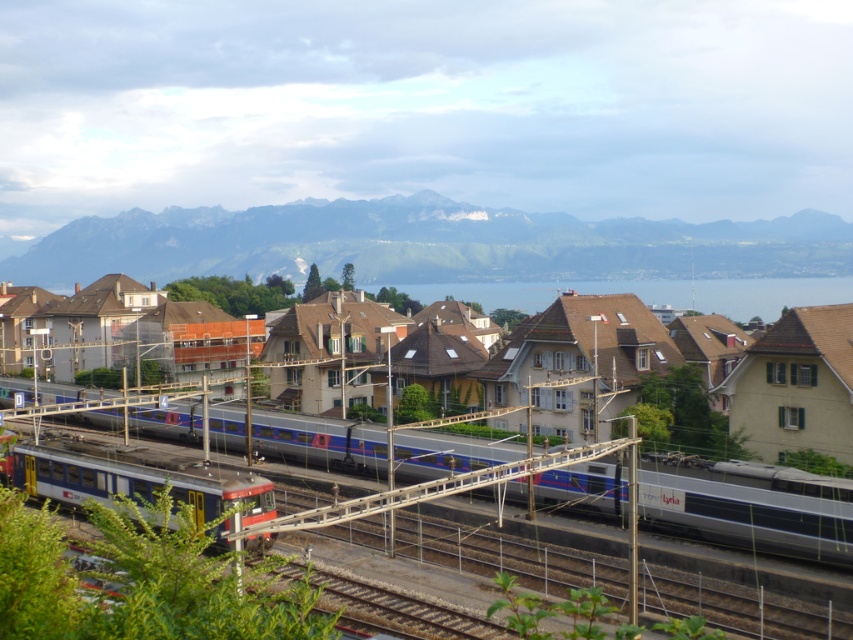
You are a photographer planning to capture the blue metallic train at lower left and the blue water at center in a single shot. Based on their sizes in the image, which object will appear smaller in the final photo?

The blue metallic train at lower left appears smaller in the final photo because it is shorter than the blue water at center.

You are a photographer trying to capture both the silver metallic train at center and the matte blue train at center in a single shot. Which train will appear narrower in the photo?

The silver metallic train at center will appear narrower in the photo because it is thinner than the matte blue train at center.